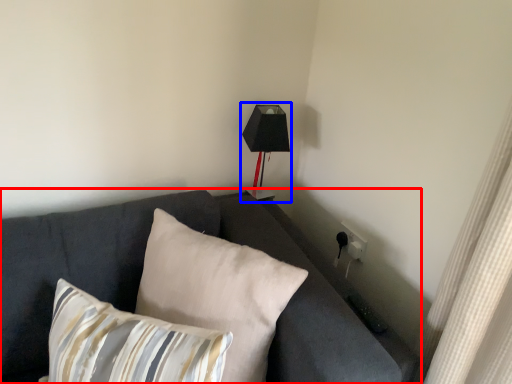
Question: Among these objects, which one is farthest to the camera, studio couch (highlighted by a red box) or table lamp (highlighted by a blue box)?

Choices:
 (A) studio couch
 (B) table lamp

Answer: (B)